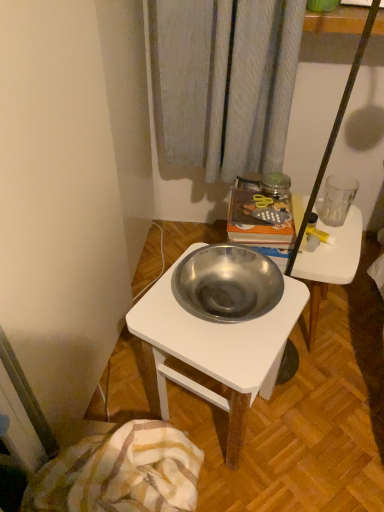
Find the location of `free point above metallic white desk at center (from a real-world perspective)`. free point above metallic white desk at center (from a real-world perspective) is located at coordinates (229, 314).